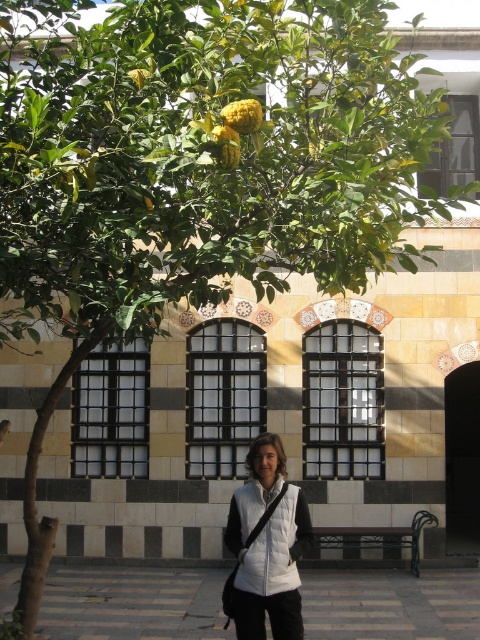
Can you confirm if smooth stone pavement at center is wider than white puffer vest at center?

Yes, smooth stone pavement at center is wider than white puffer vest at center.

Measure the distance between smooth stone pavement at center and camera.

smooth stone pavement at center is 10.74 meters from camera.

Which is behind, point (324, 600) or point (230, 534)?

Point (324, 600)

Find the location of `smooth stone pavement at center`. smooth stone pavement at center is located at coordinates (132, 604).